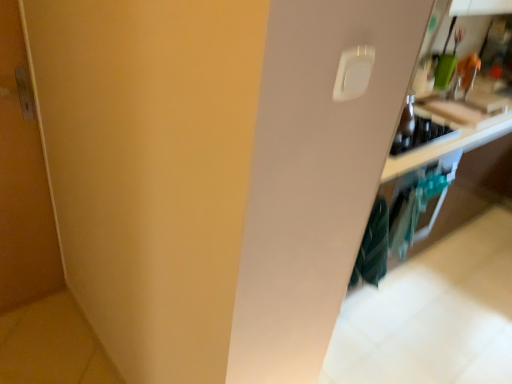
Question: Does point (495, 110) appear closer or farther from the camera than point (369, 218)?

Choices:
 (A) farther
 (B) closer

Answer: (A)

Question: From the image's perspective, is wooden cutting board at upper right positioned above or below teal striped fabric at lower right?

Choices:
 (A) below
 (B) above

Answer: (B)

Question: Estimate the real-world distances between objects in this image. Which object is farther from the teal striped fabric at lower right?

Choices:
 (A) matte wood door at left
 (B) wooden cutting board at upper right
 (C) white plastic light switch at upper right

Answer: (A)

Question: Based on their relative distances, which object is farther from the wooden cutting board at upper right?

Choices:
 (A) matte wood door at left
 (B) teal striped fabric at lower right
 (C) white plastic light switch at upper right

Answer: (A)